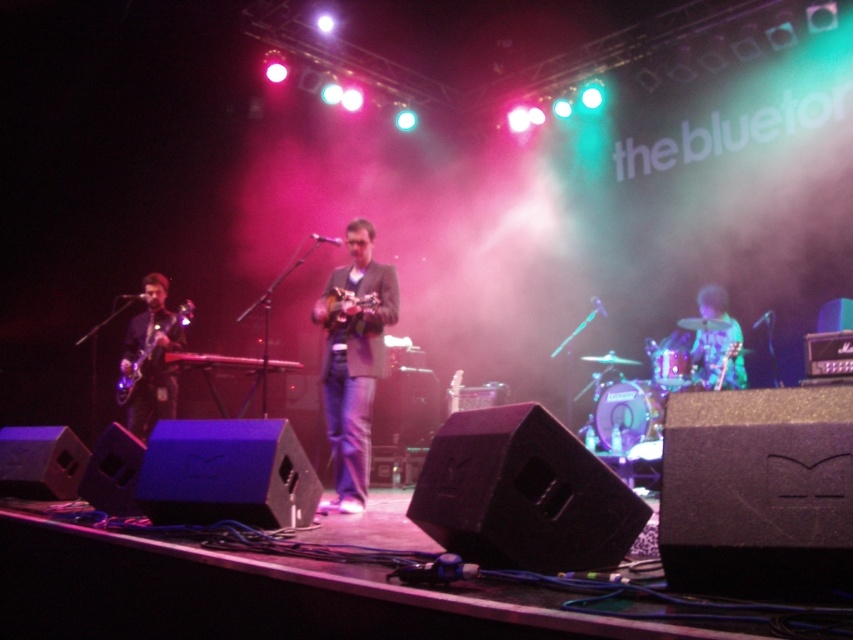
You are a stagehand setting up for a concert. You need to place a new microphone stand between the green textured guitar at right and the metallic silver keyboard at center. Based on their positions, which side of the microphone stand should be closer to the keyboard?

The green textured guitar at right is positioned on the right side of the metallic silver keyboard at center. Therefore, the microphone stand should be placed between them with the side closer to the metallic silver keyboard at center being on the left side of the stand.

You are a stagehand standing at the center of the stage. You need to retrieve the green textured guitar at right for a quick prop change. Based on its coordinates, in which general direction should you move to reach it?

The green textured guitar at right is located at coordinates point [712,333]. Since you are at the center of the stage, you should move towards the right side to reach it.